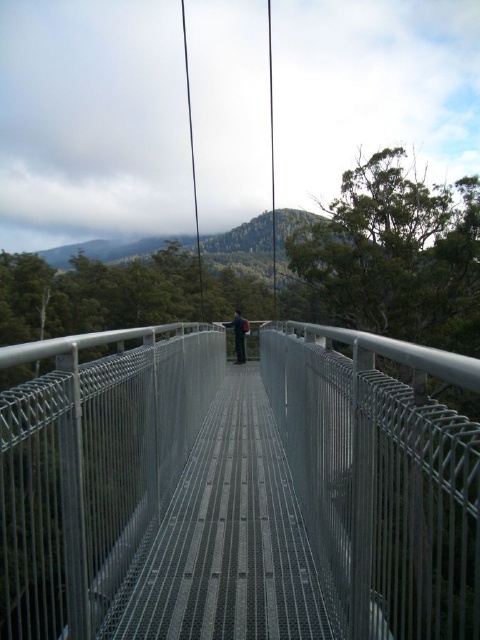
Does point (116, 336) lie behind point (245, 324)?

No, (116, 336) is closer to viewer.

Is metallic gray bridge at center bigger than black fabric backpack at center?

Correct, metallic gray bridge at center is larger in size than black fabric backpack at center.

Is point (393, 470) closer to viewer compared to point (231, 321)?

Yes.

What are the coordinates of `metallic gray bridge at center` in the screenshot? It's located at (381, 477).